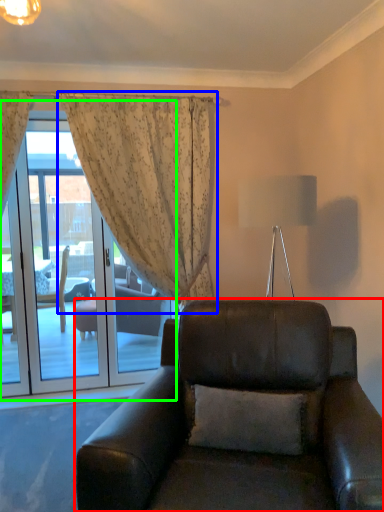
Question: Which is farther away from chair (highlighted by a red box)? curtain (highlighted by a blue box) or screen door (highlighted by a green box)?

Choices:
 (A) curtain
 (B) screen door

Answer: (B)